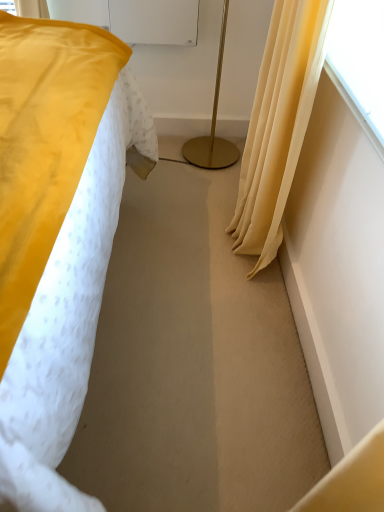
Where is `empty space that is in between gold metallic floor lamp at center and matte yellow curtain at right`? This screenshot has width=384, height=512. empty space that is in between gold metallic floor lamp at center and matte yellow curtain at right is located at coordinates (210, 201).